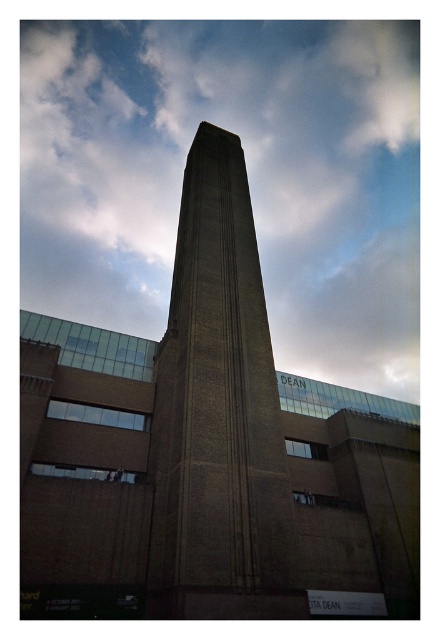
Is cloudy sky at upper center to the left of brown stone tower at center from the viewer's perspective?

Yes, cloudy sky at upper center is to the left of brown stone tower at center.

Find the location of a particular element. cloudy sky at upper center is located at coordinates (248, 173).